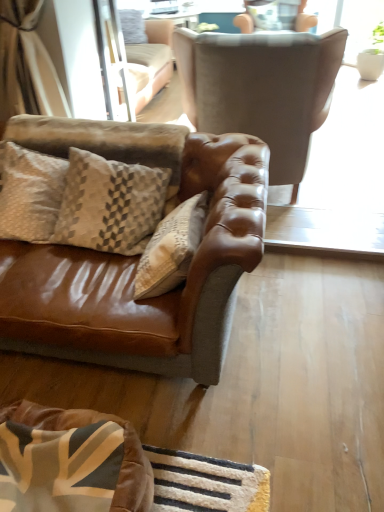
What is the approximate height of suede-like beige armchair at upper center, the 1th chair when ordered from back to front?

The height of suede-like beige armchair at upper center, the 1th chair when ordered from back to front, is 18.66 inches.

You are a GUI agent. You are given a task and a screenshot of the screen. Output one action in this format:
    pyautogui.click(x=<x>, y=<y>)
    Task: Click on the clear glass screen door at upper center
    The height and width of the screenshot is (512, 384).
    Given the screenshot: What is the action you would take?
    pyautogui.click(x=114, y=57)

Which object is closer to the camera taking this photo, suede brown armchair at upper center, which appears as the second chair when viewed from the top, or velvet brown dog bed at lower left?

velvet brown dog bed at lower left is more forward.

Is point (214, 46) farther from camera compared to point (49, 414)?

Yes.

How different are the orientations of suede brown armchair at upper center, arranged as the 1th chair when viewed from the front, and velvet brown dog bed at lower left in degrees?

There is a 178-degree angle between the facing directions of suede brown armchair at upper center, arranged as the 1th chair when viewed from the front, and velvet brown dog bed at lower left.

Is velvet brown dog bed at lower left at the back of suede brown armchair at upper center, marked as the second chair in a back-to-front arrangement?

Yes, velvet brown dog bed at lower left is at the back of suede brown armchair at upper center, marked as the second chair in a back-to-front arrangement.

Would you say suede-like beige armchair at upper center, the second chair from the front, is part of velvet brown dog bed at lower left's contents?

No, suede-like beige armchair at upper center, the second chair from the front, is not inside velvet brown dog bed at lower left.

Between velvet brown dog bed at lower left and suede-like beige armchair at upper center, the second chair from the front, which one has smaller size?

velvet brown dog bed at lower left.

Between velvet brown dog bed at lower left and suede-like beige armchair at upper center, positioned as the 1th chair in top-to-bottom order, which one appears on the right side from the viewer's perspective?

From the viewer's perspective, suede-like beige armchair at upper center, positioned as the 1th chair in top-to-bottom order, appears more on the right side.

Considering the positions of points (313, 15) and (109, 65), is point (313, 15) farther from camera compared to point (109, 65)?

Yes, point (313, 15) is behind point (109, 65).

Based on the photo, is suede-like beige armchair at upper center, positioned as the 1th chair in top-to-bottom order, not near clear glass screen door at upper center?

suede-like beige armchair at upper center, positioned as the 1th chair in top-to-bottom order, is positioned a significant distance from clear glass screen door at upper center.

Considering the relative sizes of suede-like beige armchair at upper center, acting as the 2th chair starting from the bottom, and clear glass screen door at upper center in the image provided, is suede-like beige armchair at upper center, acting as the 2th chair starting from the bottom, smaller than clear glass screen door at upper center?

Actually, suede-like beige armchair at upper center, acting as the 2th chair starting from the bottom, might be larger than clear glass screen door at upper center.

From a real-world perspective, is clear glass screen door at upper center positioned above or below suede brown armchair at upper center, marked as the second chair in a back-to-front arrangement?

clear glass screen door at upper center is above suede brown armchair at upper center, marked as the second chair in a back-to-front arrangement.

Based on the photo, is clear glass screen door at upper center oriented towards suede brown armchair at upper center, the 1th chair from the bottom?

Yes.

Considering the sizes of clear glass screen door at upper center and suede brown armchair at upper center, which appears as the second chair when viewed from the top, in the image, is clear glass screen door at upper center taller or shorter than suede brown armchair at upper center, which appears as the second chair when viewed from the top,?

Considering their sizes, clear glass screen door at upper center has less height than suede brown armchair at upper center, which appears as the second chair when viewed from the top.

Considering the sizes of objects beige textured pillow at left and clear glass screen door at upper center in the image provided, who is bigger, beige textured pillow at left or clear glass screen door at upper center?

Bigger between the two is clear glass screen door at upper center.

Based on the photo, which point is more forward, (38, 153) or (112, 10)?

The point (38, 153) is in front.

From the image's perspective, is beige textured pillow at left beneath clear glass screen door at upper center?

Yes.

Is velvet brown dog bed at lower left positioned with its back to beige textured pillow at left?

No, velvet brown dog bed at lower left's orientation is not away from beige textured pillow at left.

Between point (142, 464) and point (36, 195), which one is positioned in front?

The point (142, 464) is more forward.

From a real-world perspective, which is physically below, velvet brown dog bed at lower left or beige textured pillow at left?

velvet brown dog bed at lower left, from a real-world perspective.

Is velvet brown dog bed at lower left inside the boundaries of beige textured pillow at left, or outside?

velvet brown dog bed at lower left lies outside beige textured pillow at left.

From the image's perspective, is beige textured pillow at left located above or below velvet brown dog bed at lower left?

From the image's perspective, beige textured pillow at left appears above velvet brown dog bed at lower left.

Is beige textured pillow at left oriented towards velvet brown dog bed at lower left?

No, beige textured pillow at left is not turned towards velvet brown dog bed at lower left.

You are a GUI agent. You are given a task and a screenshot of the screen. Output one action in this format:
    pyautogui.click(x=<x>, y=<y>)
    Task: Click on the pillow that appears above the velvet brown dog bed at lower left (from the image's perspective)
    Image resolution: width=384 pixels, height=512 pixels.
    Given the screenshot: What is the action you would take?
    pyautogui.click(x=29, y=193)

Considering the relative sizes of beige textured pillow at left and velvet brown dog bed at lower left in the image provided, is beige textured pillow at left taller than velvet brown dog bed at lower left?

Indeed, beige textured pillow at left has a greater height compared to velvet brown dog bed at lower left.

Where is `dog bed below the suede brown armchair at upper center, marked as the second chair in a back-to-front arrangement (from the image's perspective)`? This screenshot has width=384, height=512. dog bed below the suede brown armchair at upper center, marked as the second chair in a back-to-front arrangement (from the image's perspective) is located at coordinates (92, 423).

Identify the location of dog bed in front of the suede-like beige armchair at upper center, the 1th chair when ordered from back to front. This screenshot has height=512, width=384. pyautogui.click(x=92, y=423).

Looking at the image, which one is located closer to clear glass screen door at upper center, velvet brown dog bed at lower left or beige textured pillow at left?

beige textured pillow at left is positioned closer to the anchor clear glass screen door at upper center.

Considering their positions, is suede-like beige armchair at upper center, positioned as the 1th chair in top-to-bottom order, positioned closer to clear glass screen door at upper center than suede brown armchair at upper center, which appears as the second chair when viewed from the top?

suede brown armchair at upper center, which appears as the second chair when viewed from the top, lies closer to clear glass screen door at upper center than the other object.

When comparing their distances from beige textured pillow at left, does suede brown armchair at upper center, arranged as the 1th chair when viewed from the front, or clear glass screen door at upper center seem closer?

A: clear glass screen door at upper center lies closer to beige textured pillow at left than the other object.

When comparing their distances from suede-like beige armchair at upper center, acting as the 2th chair starting from the bottom, does clear glass screen door at upper center or beige textured pillow at left seem further?

The object further to suede-like beige armchair at upper center, acting as the 2th chair starting from the bottom, is beige textured pillow at left.

Estimate the real-world distances between objects in this image. Which object is further from beige textured pillow at left, suede-like beige armchair at upper center, the 1th chair when ordered from back to front, or clear glass screen door at upper center?

Among the two, suede-like beige armchair at upper center, the 1th chair when ordered from back to front, is located further to beige textured pillow at left.

Considering their positions, is suede brown armchair at upper center, marked as the second chair in a back-to-front arrangement, positioned further to velvet brown dog bed at lower left than clear glass screen door at upper center?

Among the two, clear glass screen door at upper center is located further to velvet brown dog bed at lower left.

Looking at this image, from the image, which object appears to be farther from suede-like beige armchair at upper center, positioned as the 1th chair in top-to-bottom order, clear glass screen door at upper center or velvet brown dog bed at lower left?

velvet brown dog bed at lower left is positioned further to the anchor suede-like beige armchair at upper center, positioned as the 1th chair in top-to-bottom order.

Considering their positions, is clear glass screen door at upper center positioned closer to velvet brown dog bed at lower left than suede brown armchair at upper center, which appears as the second chair when viewed from the top?

suede brown armchair at upper center, which appears as the second chair when viewed from the top, is closer to velvet brown dog bed at lower left.

Locate an element on the screen. This screenshot has height=512, width=384. screen door between beige textured pillow at left and suede brown armchair at upper center, arranged as the 1th chair when viewed from the front, from left to right is located at coordinates (114, 57).

The width and height of the screenshot is (384, 512). What are the coordinates of `pillow that lies between clear glass screen door at upper center and velvet brown dog bed at lower left from top to bottom` in the screenshot? It's located at (29, 193).

The width and height of the screenshot is (384, 512). Identify the location of screen door between velvet brown dog bed at lower left and suede-like beige armchair at upper center, the 1th chair when ordered from back to front, along the z-axis. 114,57.

Locate an element on the screen. The width and height of the screenshot is (384, 512). screen door positioned between beige textured pillow at left and suede-like beige armchair at upper center, acting as the 2th chair starting from the bottom, from near to far is located at coordinates (114, 57).